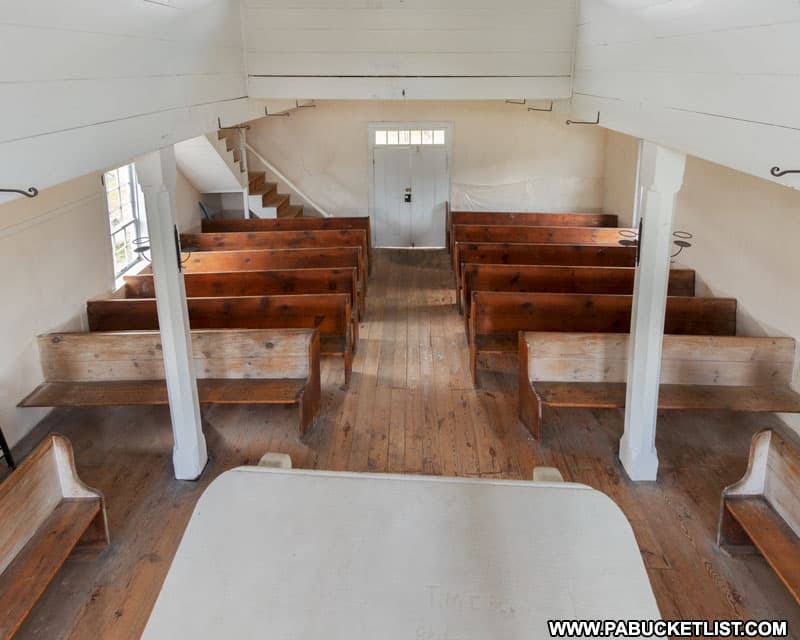
This screenshot has height=640, width=800. Identify the location of wood floor. (402, 403).